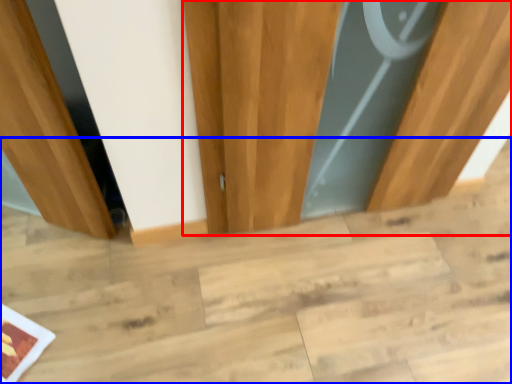
Question: Which of the following is the farthest to the observer, door (highlighted by a red box) or stair (highlighted by a blue box)?

Choices:
 (A) door
 (B) stair

Answer: (B)